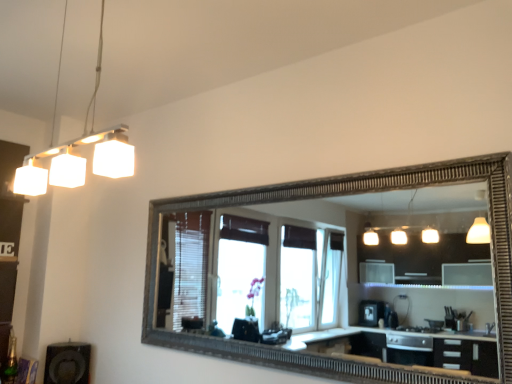
Question: Considering the relative positions of matte white dresser at left and white matte light fixture at upper left in the image provided, is matte white dresser at left to the right of white matte light fixture at upper left from the viewer's perspective?

Choices:
 (A) yes
 (B) no

Answer: (B)

Question: Does matte white dresser at left have a lesser height compared to white matte light fixture at upper left?

Choices:
 (A) no
 (B) yes

Answer: (A)

Question: Can you confirm if matte white dresser at left is wider than white matte light fixture at upper left?

Choices:
 (A) yes
 (B) no

Answer: (A)

Question: Can you see matte white dresser at left touching white matte light fixture at upper left?

Choices:
 (A) no
 (B) yes

Answer: (A)

Question: Is matte white dresser at left outside of white matte light fixture at upper left?

Choices:
 (A) yes
 (B) no

Answer: (A)

Question: From a real-world perspective, is matte white dresser at left positioned above or below black matte speaker at lower left?

Choices:
 (A) above
 (B) below

Answer: (A)

Question: In the image, is matte white dresser at left on the left side or the right side of black matte speaker at lower left?

Choices:
 (A) left
 (B) right

Answer: (A)

Question: Does point (20, 152) appear closer or farther from the camera than point (73, 360)?

Choices:
 (A) closer
 (B) farther

Answer: (B)

Question: Which is correct: matte white dresser at left is inside black matte speaker at lower left, or outside of it?

Choices:
 (A) inside
 (B) outside

Answer: (B)

Question: Is black matte speaker at lower left spatially inside matte white dresser at left, or outside of it?

Choices:
 (A) outside
 (B) inside

Answer: (A)

Question: Is point (76, 349) positioned closer to the camera than point (1, 286)?

Choices:
 (A) farther
 (B) closer

Answer: (B)

Question: In terms of width, does black matte speaker at lower left look wider or thinner when compared to matte white dresser at left?

Choices:
 (A) wide
 (B) thin

Answer: (A)

Question: From a real-world perspective, is black matte speaker at lower left physically located above or below matte white dresser at left?

Choices:
 (A) above
 (B) below

Answer: (B)

Question: From the image's perspective, is black matte speaker at lower left above or below white matte light fixture at upper left?

Choices:
 (A) above
 (B) below

Answer: (B)

Question: Relative to white matte light fixture at upper left, is black matte speaker at lower left in front or behind?

Choices:
 (A) front
 (B) behind

Answer: (B)